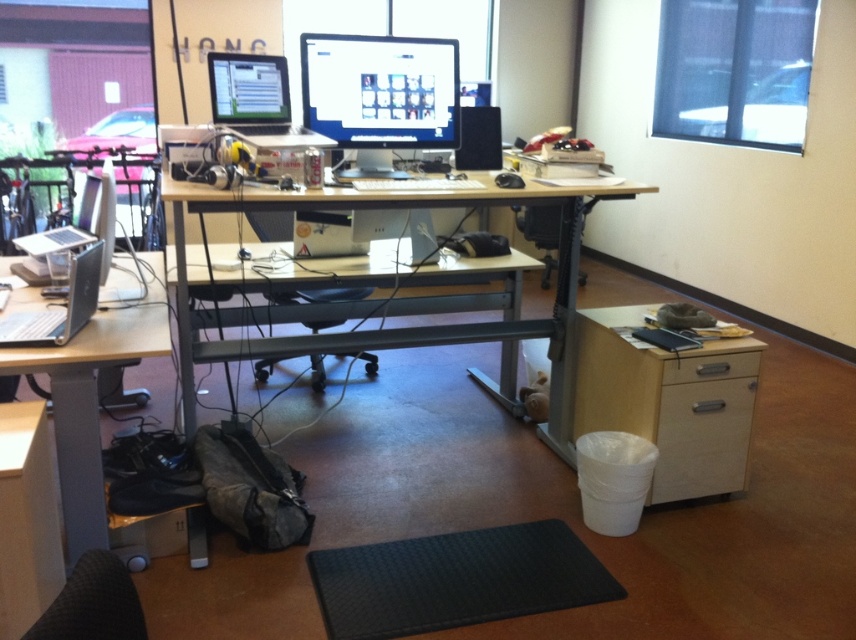
You are organizing a desk and need to place a new monitor that requires 50 cm of space. Given the wooden desk at center and the silver metallic laptop at left, which object has enough space to accommodate the new monitor?

The wooden desk at center is larger in size than the silver metallic laptop at left, so the wooden desk at center has enough space to accommodate the new monitor.

You are organizing a small event and need to place a 1.2 meter long banner on the wooden desk at center. Considering the space occupied by the silver metallic laptop at left, will the banner fit horizontally on the desk?

The wooden desk at center might be wider than the silver metallic laptop at left, but without knowing the exact width of the desk or the laptop, it is uncertain if the 1.2 meter banner will fit horizontally. Additional measurements are needed to confirm.

You are an office worker who needs to reach the black rubber yoga mat at lower center to do some stretching. However, you are currently sitting on the black mesh office chair at center. Can you easily reach the yoga mat without moving your chair?

The black rubber yoga mat at lower center is located below the black mesh office chair at center, so it is positioned under the chair. Since the yoga mat is underneath the chair, you would need to move the chair to access it, making it difficult to reach without adjusting the chair.